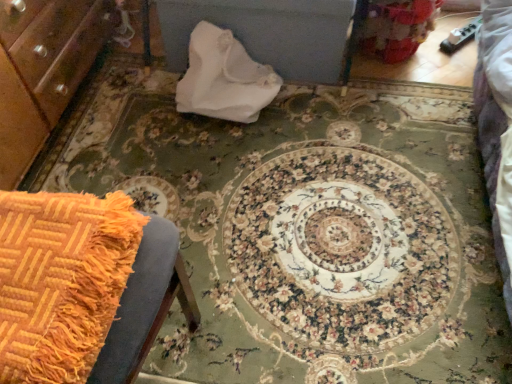
This screenshot has width=512, height=384. Identify the location of vacant space positioned to the left of white paper bag at center. (143, 105).